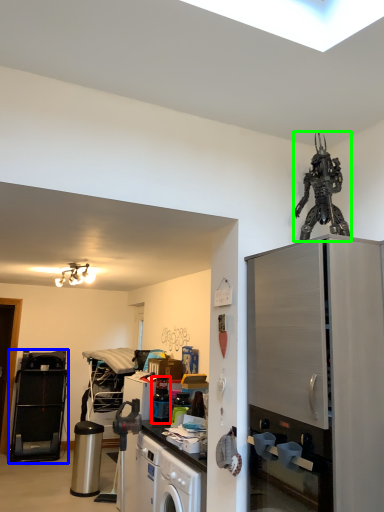
Question: Which object is positioned closest to appliance (highlighted by a red box)? Select from appliance (highlighted by a blue box) and toy (highlighted by a green box).

Choices:
 (A) appliance
 (B) toy

Answer: (B)